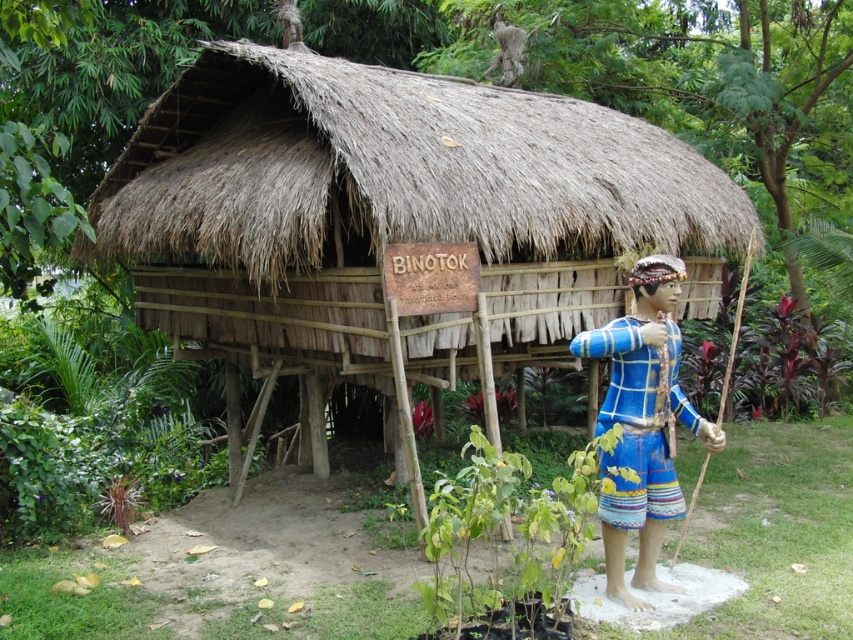
You are an anthropologist visiting this site and need to document the spatial relationship between the thatched wood hut at center and the blue woven fabric at right. Which object is narrower in width?

The thatched wood hut at center is narrower than the blue woven fabric at right.

Based on the coordinates provided, which structure is located at point (390,209) in the image?

The point (390,209) corresponds to the thatched wood hut at center.